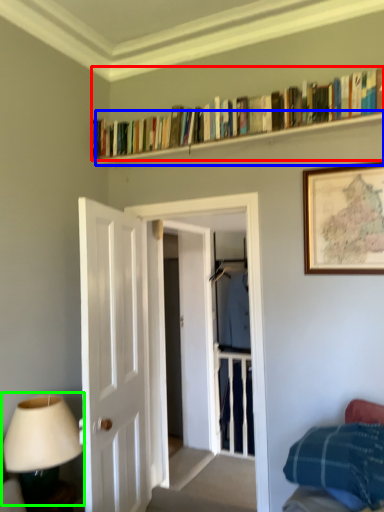
Question: Which object is the closest to the book (highlighted by a red box)? Choose among these: shelf (highlighted by a blue box) or table lamp (highlighted by a green box).

Choices:
 (A) shelf
 (B) table lamp

Answer: (A)